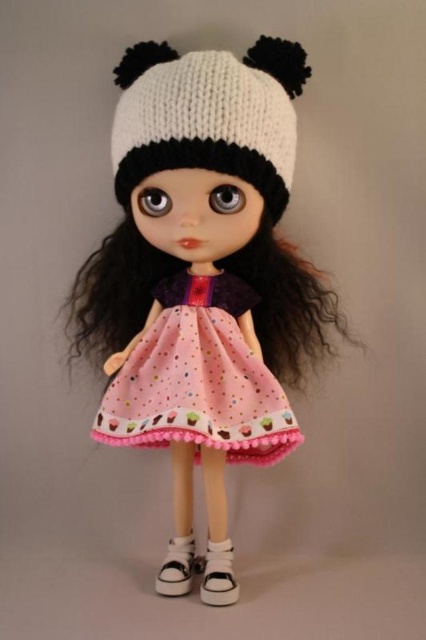
Question: Can you confirm if matte white knit hat at upper center is bigger than white canvas sneaker at lower center?

Choices:
 (A) yes
 (B) no

Answer: (A)

Question: Considering the real-world distances, which object is closest to the white canvas shoe at lower center?

Choices:
 (A) white knitted hat at center
 (B) white canvas sneaker at lower center

Answer: (B)

Question: Considering the real-world distances, which object is closest to the white knitted hat at center?

Choices:
 (A) white canvas shoe at lower center
 (B) matte white knit hat at upper center

Answer: (B)

Question: Among these objects, which one is nearest to the camera?

Choices:
 (A) pink fabric dress at center
 (B) white knitted hat at center
 (C) white canvas sneaker at lower center
 (D) matte white knit hat at upper center

Answer: (B)

Question: Does matte white knit hat at upper center appear under pink fabric dress at center?

Choices:
 (A) no
 (B) yes

Answer: (A)

Question: Is white knitted hat at center behind white canvas shoe at lower center?

Choices:
 (A) no
 (B) yes

Answer: (A)